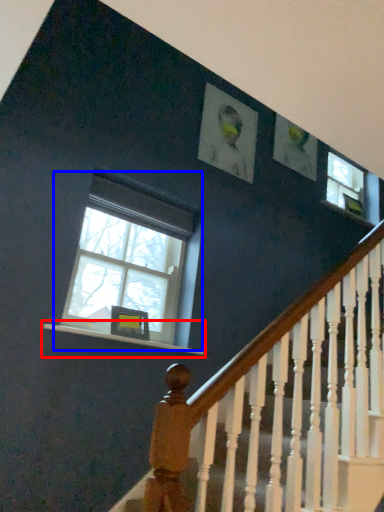
Question: Which object is closer to the camera taking this photo, window sill (highlighted by a red box) or window (highlighted by a blue box)?

Choices:
 (A) window sill
 (B) window

Answer: (A)